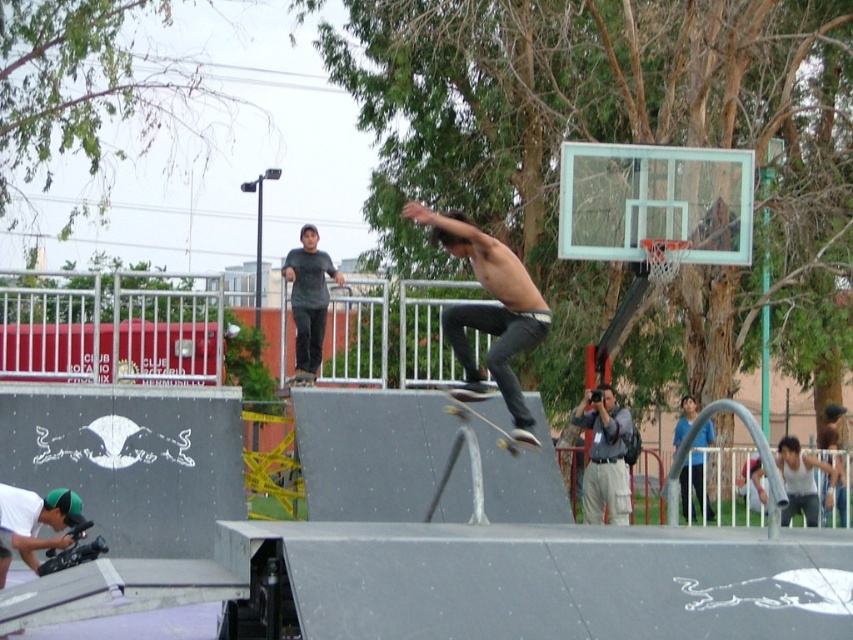
You are a spectator standing at the edge of the skatepark. You notice two points marked in the scene. The first point is at coordinates point (512, 401) and the second is at point (500, 429). From your perspective, which point is closer to you?

Point (512, 401) is in front of point (500, 429), so it is closer to you.

You are a skateboarder who wants to choose a board for a trick that requires a smaller board for better maneuverability. Given that you see both the shiny black skateboard at center and the wooden smooth skateboard at center, which one should you pick?

The wooden smooth skateboard at center is smaller in size compared to the shiny black skateboard at center, so you should pick the wooden smooth skateboard at center for better maneuverability.

You are a photographer standing at the camera position. You want to take a photo of the shiny black skateboard at center. The camera has a 50mm lens with a maximum aperture of f1.4. Can you focus on the skateboard clearly without any motion blur?

The shiny black skateboard at center and camera are 15.47 meters apart from each other. With a 50mm lens and f1.4 aperture, the depth of field might be insufficient to keep the skateboard in focus at this distance. Additionally, since the skateboard is moving, motion blur could occur unless a fast shutter speed is used. To ensure clarity, increase the shutter speed to at least 1 over the focal length multiplied by 5, so 1 over 250 seconds, and use a tripod for stability.